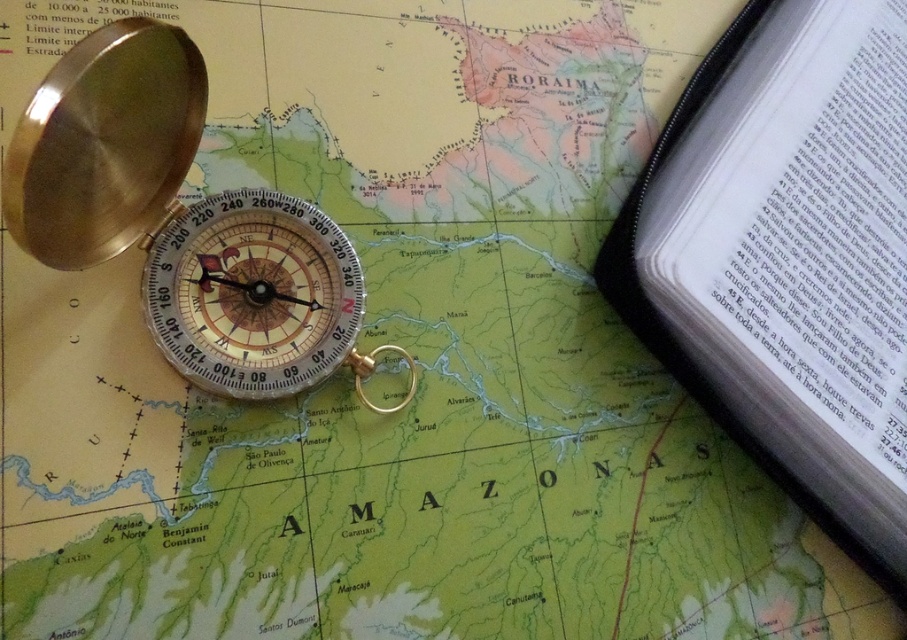
You are a cartographer working on a map and need to place a white paper book at lower right and a gold polished compass at upper left. Based on the scene description, which object is positioned to the east of the other?

The white paper book at lower right is to the right of gold polished compass at upper left, so the white paper book at lower right is positioned to the east of the gold polished compass at upper left.

Looking at this image, you are a surveyor using a vintage brass compass placed on a map of Brazil. You need to determine the distance from your current position to a specific point marked at coordinates point (681,326). Can you reach that point without moving more than 1.3 meters from your current position?

The distance of point (681,326) from the camera is 1.31 meters. Since 1.31 meters is slightly more than 1.3 meters, you cannot reach the point without moving more than 1.3 meters from your current position.

You are examining a map with two points marked on it. The first point is at coordinates point [725,282] and the second is at point [102,96]. Based on the map layout, which point is closer to the viewer?

Point [725,282] is further to the camera than point [102,96]. Therefore, the point at [102,96] is closer to the viewer.